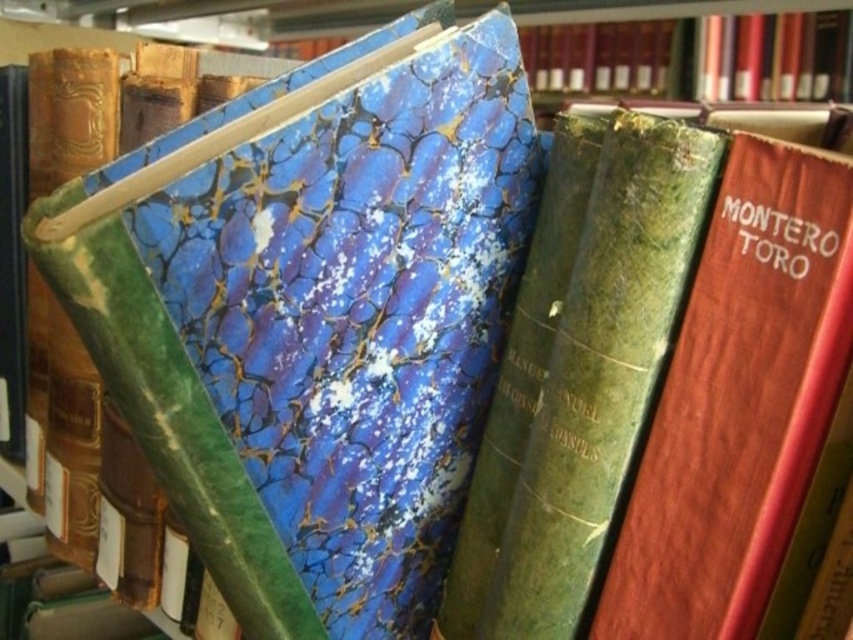
You are standing in front of the bookshelf and want to reach the point marked at coordinates (699, 428). If your hand can extend 60 centimeters, can you comfortably reach that point?

Answer: The point at coordinates (699, 428) is 50.99 centimeters away from the viewer. Since your hand can extend 60 centimeters, you can comfortably reach it.

You are organizing books on a shelf and have two books in front of you. The wooden book at center and the green marbled book at center. Which book is thicker?

The green marbled book at center is thicker than the wooden book at center.